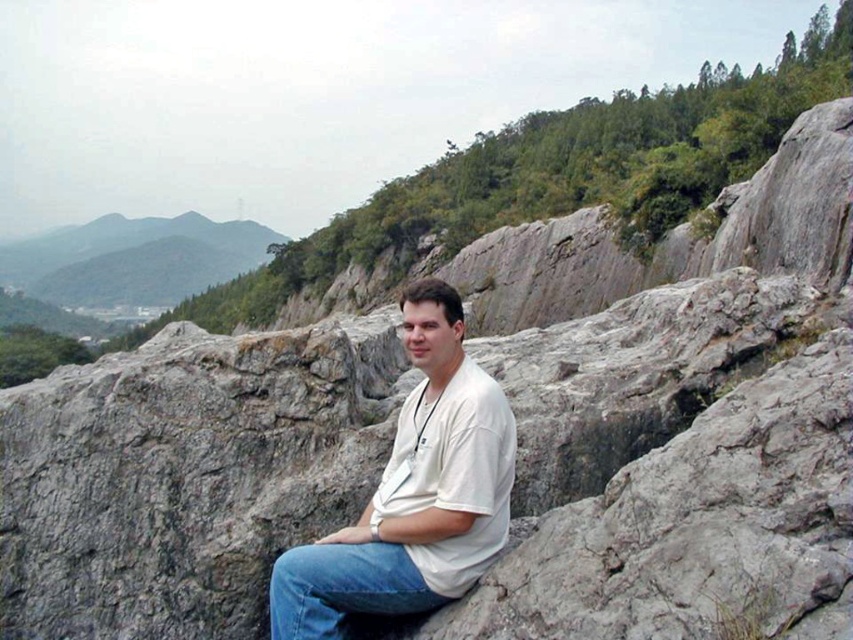
You are a photographer trying to capture a portrait of the person in the scene. You notice the white matte shirt at center and the green grassy hill at upper left in your frame. Which object should you focus on to ensure the subject is sharp?

The white matte shirt at center is closer to the viewer than the green grassy hill at upper left, so focusing on the white matte shirt at center will ensure the subject is sharp.

You are a drone operator trying to map the terrain. You have a drone with a camera that can capture a 60 degree field of view. You want to take a photo of the green grassy hill at upper left. What coordinate should you fly your drone to in order to capture the hill in the center of the photo?

The green grassy hill at upper left is located at coordinate point (x=132, y=259). To center it in the photo, the drone should be positioned at the same coordinates.

You are a drone operator trying to capture a photo of the two points in the image. The first point is at coordinates point (82, 248) and the second is at point (396, 611). Since you want to ensure both points are in focus, you need to know which point is closer to the camera. Which point is closer to the camera?

Point (82, 248) is further to the viewer than point (396, 611), so the point closer to the camera is point (396, 611).